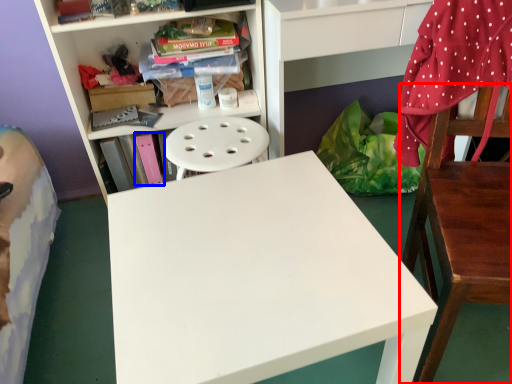
Question: Which point is further to the camera, chair (highlighted by a red box) or book (highlighted by a blue box)?

Choices:
 (A) chair
 (B) book

Answer: (B)